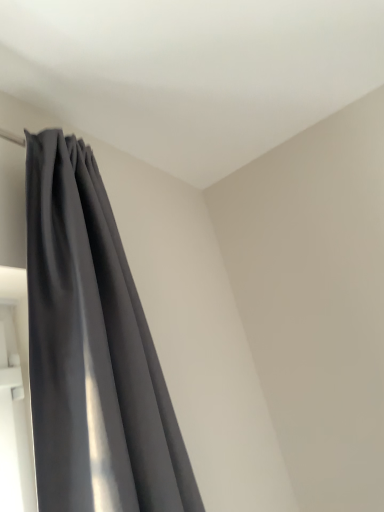
What is the approximate height of matte gray curtain at left?

It is 1.06 meters.

The width and height of the screenshot is (384, 512). What do you see at coordinates (93, 351) in the screenshot?
I see `matte gray curtain at left` at bounding box center [93, 351].

Locate an element on the screen. This screenshot has height=512, width=384. matte gray curtain at left is located at coordinates (93, 351).

Measure the distance between point (64, 457) and camera.

The depth of point (64, 457) is 32.91 inches.

The height and width of the screenshot is (512, 384). What are the coordinates of `matte gray curtain at left` in the screenshot? It's located at (93, 351).